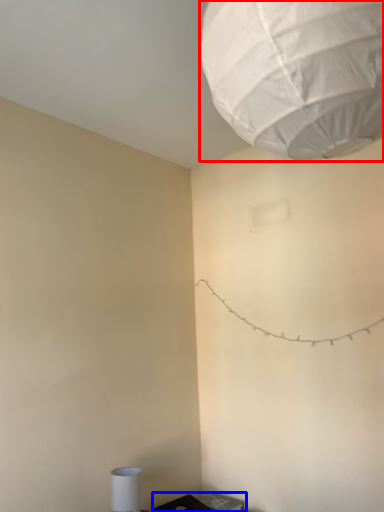
Question: Among these objects, which one is nearest to the camera, lantern (highlighted by a red box) or furniture (highlighted by a blue box)?

Choices:
 (A) lantern
 (B) furniture

Answer: (A)